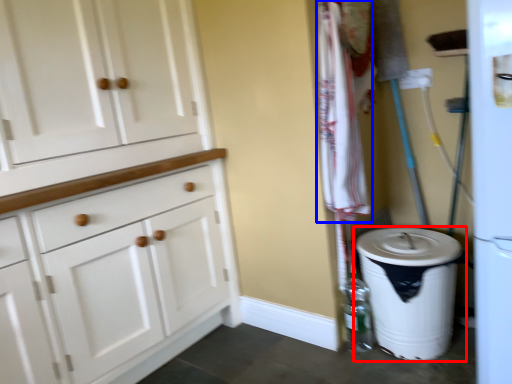
Question: Among these objects, which one is farthest to the camera, waste container (highlighted by a red box) or laundry (highlighted by a blue box)?

Choices:
 (A) waste container
 (B) laundry

Answer: (A)